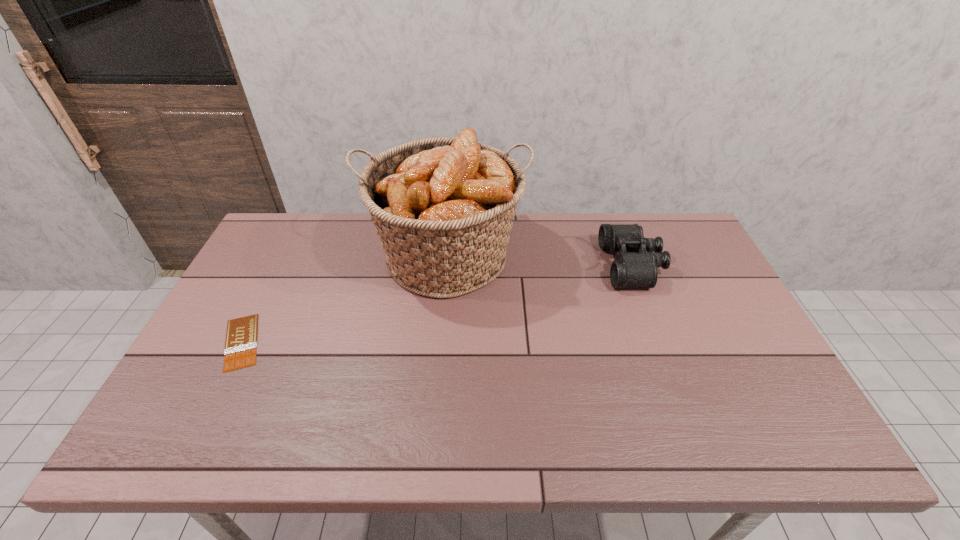
Where is `free space between the second shortest object and the tallest object`? The image size is (960, 540). free space between the second shortest object and the tallest object is located at coordinates (540, 261).

Where is `blank region between the shortest object and the second object from left to right`? blank region between the shortest object and the second object from left to right is located at coordinates (344, 300).

Where is `empty space between the second object from right to left and the second tallest object`? The height and width of the screenshot is (540, 960). empty space between the second object from right to left and the second tallest object is located at coordinates (540, 261).

Where is `free space between the rightmost object and the chocolate bar`? This screenshot has height=540, width=960. free space between the rightmost object and the chocolate bar is located at coordinates (437, 303).

Identify the location of vacant space in between the binoculars and the tallest object. (540, 261).

Locate an element on the screen. The image size is (960, 540). free spot between the tallest object and the second tallest object is located at coordinates (540, 261).

Identify the location of vacant space that's between the binoculars and the tallest object. (540, 261).

Locate an element on the screen. The width and height of the screenshot is (960, 540). empty space between the second tallest object and the basket is located at coordinates (540, 261).

Find the location of a particular element. free space between the second object from left to right and the second shortest object is located at coordinates (540, 261).

Find the location of a particular element. empty location between the tallest object and the chocolate bar is located at coordinates tap(344, 300).